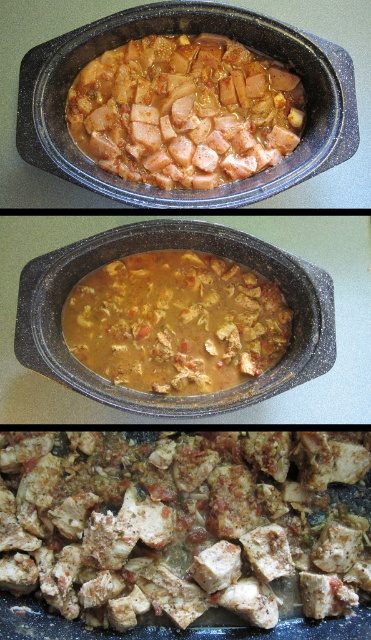
The height and width of the screenshot is (640, 371). Describe the element at coordinates (185, 524) in the screenshot. I see `brown matte diced meat at center` at that location.

Find the location of a particular element. brown matte diced meat at center is located at coordinates pos(185,524).

Does point (178, 556) lie in front of point (257, 291)?

No, (178, 556) is further to viewer.

In order to click on brown matte diced meat at center in this screenshot , I will do `click(185, 524)`.

Between brown matte diced meat at center and brown matte sausage at center, which one has less height?

Standing shorter between the two is brown matte sausage at center.

Between brown matte diced meat at center and brown matte sausage at center, which one is positioned higher?

brown matte sausage at center is above.

Who is more distant from viewer, (335, 604) or (173, 42)?

Point (173, 42)

The image size is (371, 640). I want to click on brown matte diced meat at center, so click(185, 524).

Does brown matte sausage at center come in front of brown matte stew at center?

No, it is behind brown matte stew at center.

Which is behind, point (123, 150) or point (208, 348)?

The point (123, 150) is more distant.

This screenshot has height=640, width=371. I want to click on brown matte sausage at center, so click(x=185, y=112).

At what (x,y) coordinates should I click in order to perform the action: click on brown matte sausage at center. Please return your answer as a coordinate pair (x, y). Looking at the image, I should click on (185, 112).